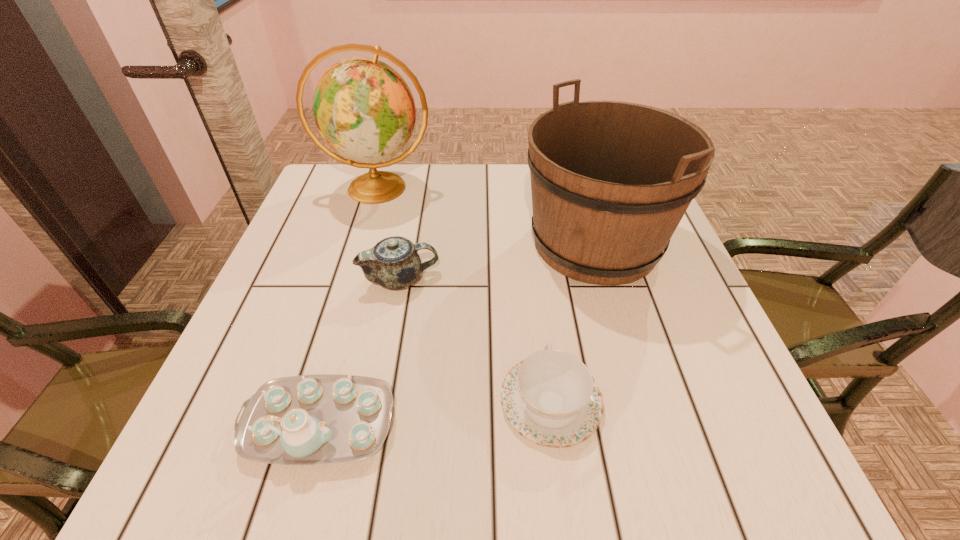
The width and height of the screenshot is (960, 540). I want to click on free space at the left edge, so [x=356, y=221].

Find the location of `vacant space at the right edge of the desktop`. vacant space at the right edge of the desktop is located at coordinates (637, 291).

In the image, there is a desktop. Identify the location of free space at the near left corner. The image size is (960, 540). (191, 476).

Locate an element on the screen. Image resolution: width=960 pixels, height=540 pixels. vacant space that is in between the farthest chinaware and the globe is located at coordinates (389, 233).

This screenshot has width=960, height=540. Identify the location of free area in between the farthest chinaware and the globe. coord(389,233).

At what (x,y) coordinates should I click in order to perform the action: click on vacant space that is in between the farthest chinaware and the bucket. Please return your answer as a coordinate pair (x, y). The height and width of the screenshot is (540, 960). Looking at the image, I should click on (497, 261).

This screenshot has width=960, height=540. I want to click on vacant area between the fourth shortest object and the farthest chinaware, so click(x=497, y=261).

Find the location of a particular element. Image resolution: width=960 pixels, height=540 pixels. vacant area between the globe and the shortest chinaware is located at coordinates (465, 295).

The width and height of the screenshot is (960, 540). In order to click on vacant space that's between the bucket and the globe in this screenshot , I will do `click(487, 215)`.

Locate which object is the closest to the globe. Please provide its 2D coordinates. Your answer should be formatted as a tuple, i.e. [(x, y)], where the tuple contains the x and y coordinates of a point satisfying the conditions above.

[(393, 263)]